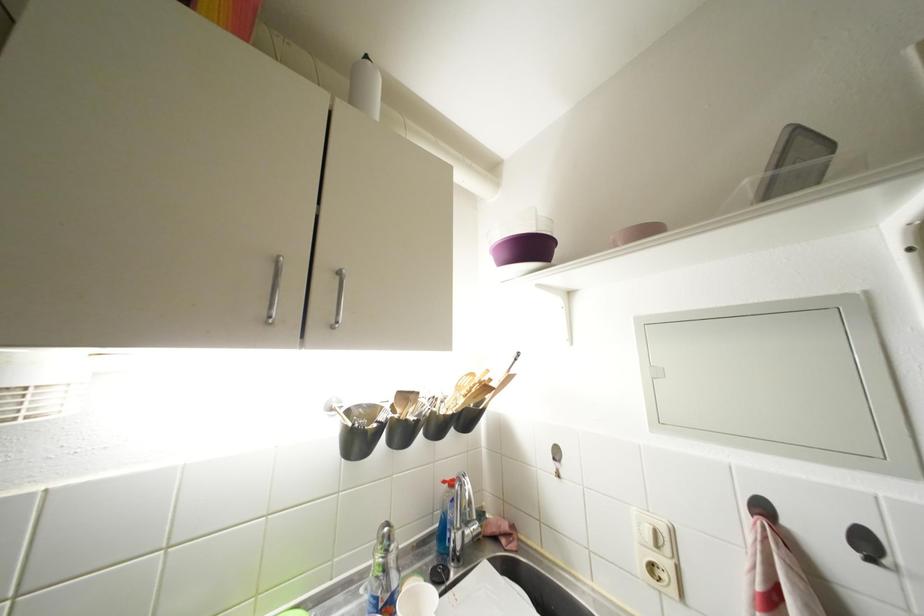
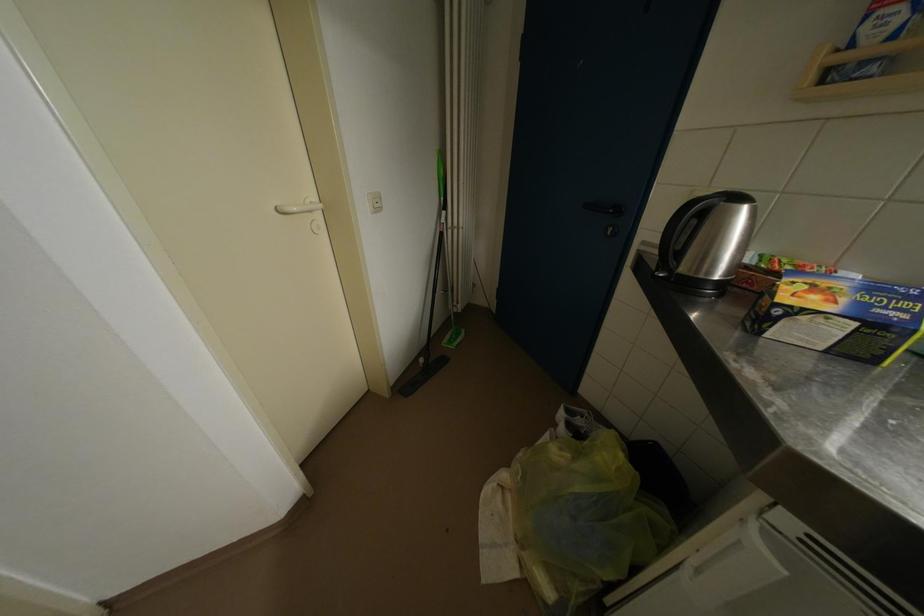
The images are taken continuously from a first-person perspective. In which direction is your viewpoint rotating?

The camera rotated toward left-down.